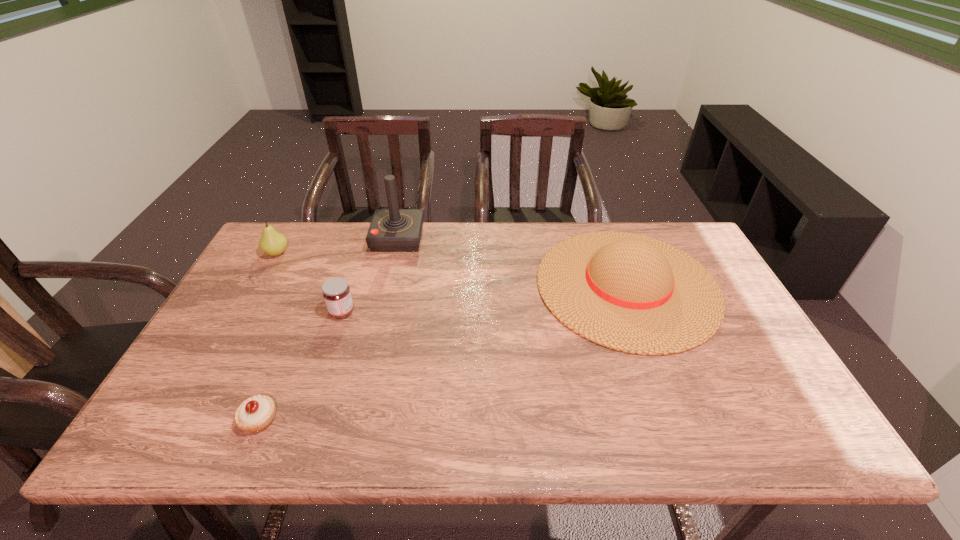
The height and width of the screenshot is (540, 960). I want to click on vacant space that satisfies the following two spatial constraints: 1. on the front side of the leftmost object; 2. on the right side of the fourth object from right to left, so click(x=183, y=419).

Image resolution: width=960 pixels, height=540 pixels. I want to click on free location that satisfies the following two spatial constraints: 1. on the rectangular base of the tallest object; 2. on the front side of the shortest object, so coord(355,419).